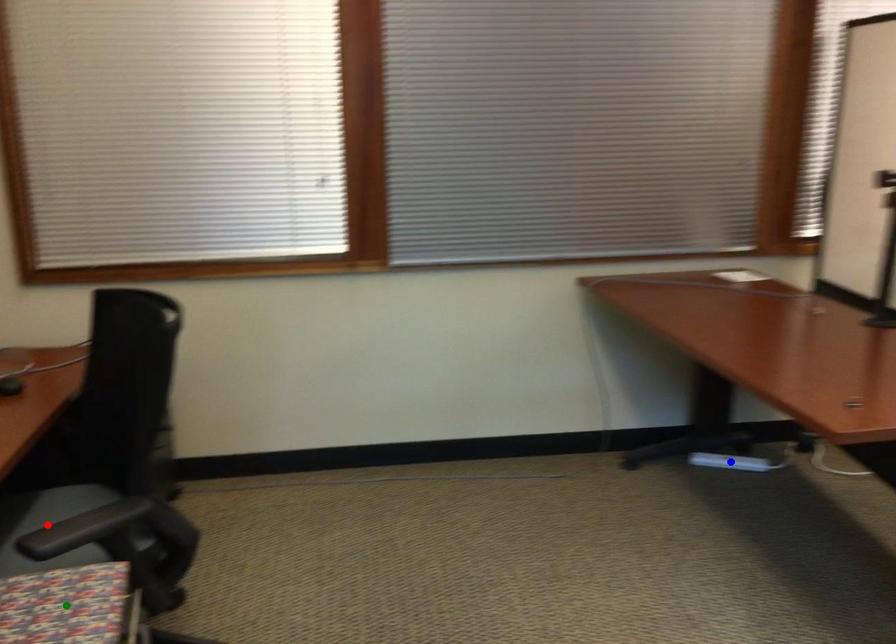
Order these from nearest to farthest:
A) blue point
B) red point
C) green point

1. green point
2. red point
3. blue point